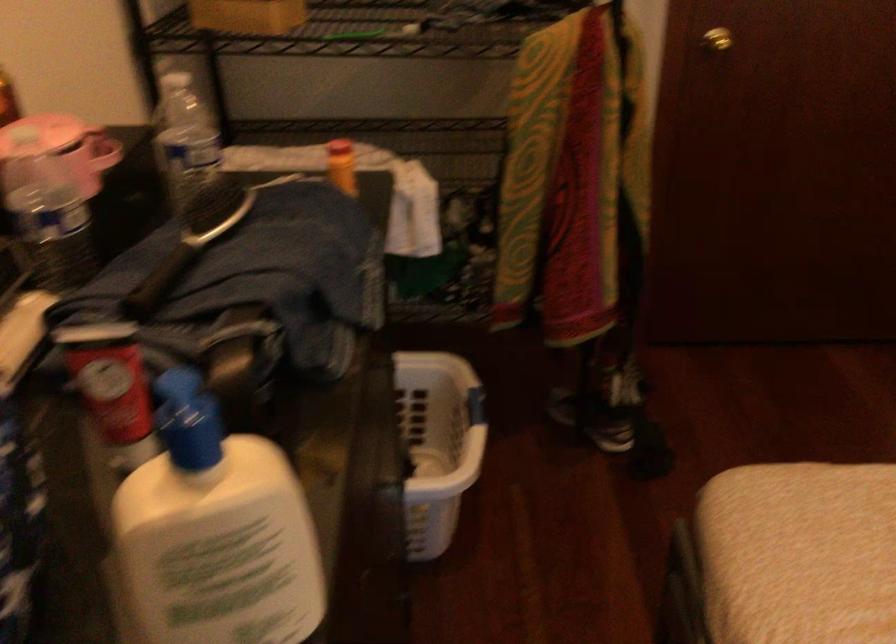
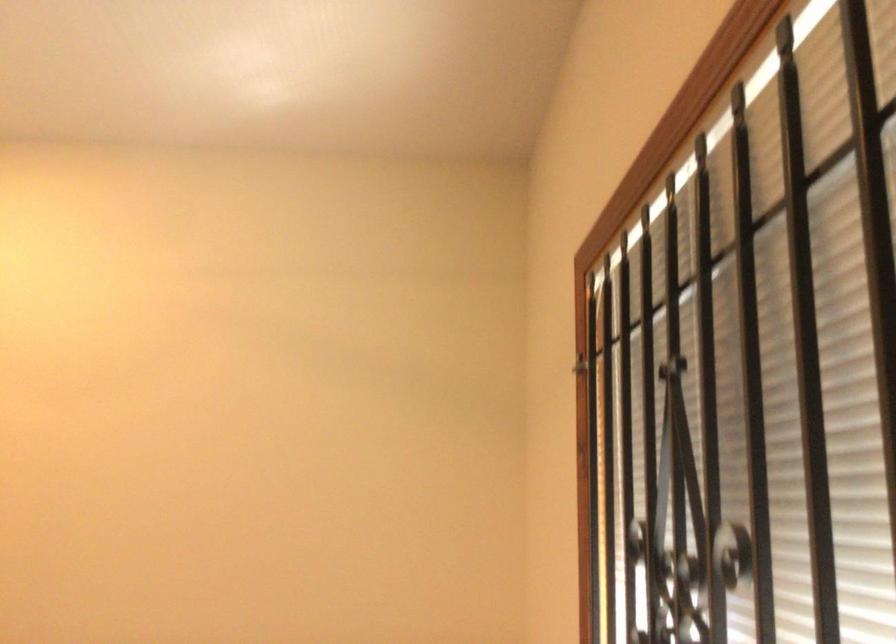
Question: Based on the continuous images, in which direction is the camera rotating? Reply with the corresponding letter.

Choices:
 (A) Left
 (B) Right
 (C) Up
 (D) Down

Answer: (B)